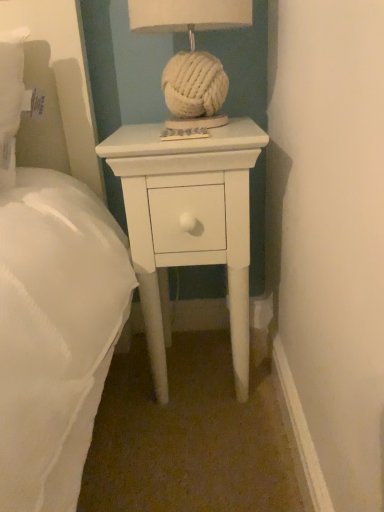
Question: Is white matte nightstand at center wider than white knitted ball at center?

Choices:
 (A) yes
 (B) no

Answer: (A)

Question: Is white matte nightstand at center directly adjacent to white knitted ball at center?

Choices:
 (A) yes
 (B) no

Answer: (B)

Question: Does white matte nightstand at center come behind white knitted ball at center?

Choices:
 (A) yes
 (B) no

Answer: (A)

Question: Is white matte nightstand at center positioned before white knitted ball at center?

Choices:
 (A) no
 (B) yes

Answer: (A)

Question: Is white knitted ball at center completely or partially inside white matte nightstand at center?

Choices:
 (A) yes
 (B) no

Answer: (B)

Question: From a real-world perspective, is white matte nightstand at center physically below white knitted ball at center?

Choices:
 (A) no
 (B) yes

Answer: (B)

Question: Considering the relative sizes of white knitted ball at center and white matte nightstand at center in the image provided, is white knitted ball at center wider than white matte nightstand at center?

Choices:
 (A) no
 (B) yes

Answer: (A)

Question: From a real-world perspective, is white knitted ball at center beneath white matte nightstand at center?

Choices:
 (A) yes
 (B) no

Answer: (B)

Question: Is white knitted ball at center facing towards white matte nightstand at center?

Choices:
 (A) no
 (B) yes

Answer: (A)

Question: Is white knitted ball at center far away from white matte nightstand at center?

Choices:
 (A) no
 (B) yes

Answer: (A)

Question: Is white matte nightstand at center completely or partially inside white knitted ball at center?

Choices:
 (A) yes
 (B) no

Answer: (B)

Question: Considering the relative sizes of white knitted ball at center and white matte nightstand at center in the image provided, is white knitted ball at center bigger than white matte nightstand at center?

Choices:
 (A) no
 (B) yes

Answer: (A)

Question: In the image, is white matte nightstand at center positioned in front of or behind white knitted ball at center?

Choices:
 (A) front
 (B) behind

Answer: (B)